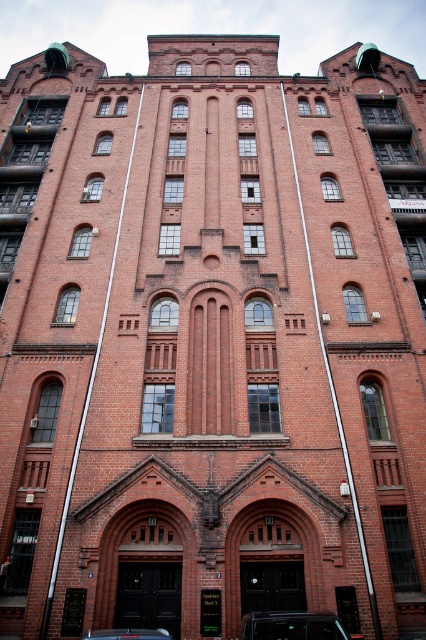
Question: Observing the image, what is the correct spatial positioning of shiny black car at lower center in reference to black glossy car at center?

Choices:
 (A) right
 (B) left

Answer: (A)

Question: Is shiny black car at lower center bigger than black glossy car at center?

Choices:
 (A) no
 (B) yes

Answer: (B)

Question: Observing the image, what is the correct spatial positioning of shiny black car at lower center in reference to black glossy car at center?

Choices:
 (A) right
 (B) left

Answer: (A)

Question: Which point is farther from the camera taking this photo?

Choices:
 (A) (97, 636)
 (B) (310, 614)

Answer: (B)